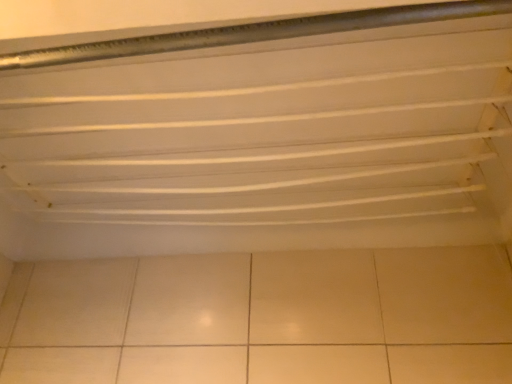
Image resolution: width=512 pixels, height=384 pixels. What do you see at coordinates (263, 318) in the screenshot? I see `beige ceramic tile at bottom` at bounding box center [263, 318].

At what (x,y) coordinates should I click in order to perform the action: click on beige ceramic tile at bottom. Please return your answer as a coordinate pair (x, y). Looking at the image, I should click on (263, 318).

What is the approximate height of beige ceramic tile at bottom?

The height of beige ceramic tile at bottom is 14.08 inches.

The height and width of the screenshot is (384, 512). Describe the element at coordinates (259, 136) in the screenshot. I see `white matte shelf at upper center` at that location.

Locate an element on the screen. The height and width of the screenshot is (384, 512). white matte shelf at upper center is located at coordinates (259, 136).

Measure the distance between white matte shelf at upper center and camera.

24.25 inches.

Locate an element on the screen. This screenshot has width=512, height=384. beige ceramic tile at bottom is located at coordinates (263, 318).

Which is more to the left, white matte shelf at upper center or beige ceramic tile at bottom?

Positioned to the left is white matte shelf at upper center.

Which is behind, white matte shelf at upper center or beige ceramic tile at bottom?

Positioned behind is beige ceramic tile at bottom.

Is point (396, 130) farther from viewer compared to point (416, 331)?

No, it is not.

From the image's perspective, is white matte shelf at upper center beneath beige ceramic tile at bottom?

No, from the image's perspective, white matte shelf at upper center is not below beige ceramic tile at bottom.

From a real-world perspective, which object rests below the other?

beige ceramic tile at bottom, from a real-world perspective.

Looking at this image, can you confirm if white matte shelf at upper center is thinner than beige ceramic tile at bottom?

Incorrect, the width of white matte shelf at upper center is not less than that of beige ceramic tile at bottom.

Can you confirm if white matte shelf at upper center is shorter than beige ceramic tile at bottom?

Indeed, white matte shelf at upper center has a lesser height compared to beige ceramic tile at bottom.

Looking at the image, does white matte shelf at upper center seem bigger or smaller compared to beige ceramic tile at bottom?

Considering their sizes, white matte shelf at upper center takes up more space than beige ceramic tile at bottom.

Would you say white matte shelf at upper center is outside beige ceramic tile at bottom?

Yes.

Are white matte shelf at upper center and beige ceramic tile at bottom located far from each other?

Actually, white matte shelf at upper center and beige ceramic tile at bottom are a little close together.

Is white matte shelf at upper center facing away from beige ceramic tile at bottom?

No, beige ceramic tile at bottom is not at the back of white matte shelf at upper center.

Can you tell me how much white matte shelf at upper center and beige ceramic tile at bottom differ in facing direction?

The angular difference between white matte shelf at upper center and beige ceramic tile at bottom is 180 degrees.

Measure the distance from white matte shelf at upper center to beige ceramic tile at bottom.

11.72 inches.

I want to click on ceramic tile behind the white matte shelf at upper center, so click(x=263, y=318).

Is beige ceramic tile at bottom to the left of white matte shelf at upper center from the viewer's perspective?

Incorrect, beige ceramic tile at bottom is not on the left side of white matte shelf at upper center.

Based on the photo, is beige ceramic tile at bottom in front of white matte shelf at upper center?

No, beige ceramic tile at bottom is further to the viewer.

Is point (129, 292) positioned after point (177, 164)?

Yes, point (129, 292) is farther from viewer.

From the image's perspective, which is above, beige ceramic tile at bottom or white matte shelf at upper center?

white matte shelf at upper center appears higher in the image.

From a real-world perspective, between beige ceramic tile at bottom and white matte shelf at upper center, who is vertically lower?

beige ceramic tile at bottom.

Can you confirm if beige ceramic tile at bottom is wider than white matte shelf at upper center?

No, beige ceramic tile at bottom is not wider than white matte shelf at upper center.

Considering the relative sizes of beige ceramic tile at bottom and white matte shelf at upper center in the image provided, is beige ceramic tile at bottom taller than white matte shelf at upper center?

Indeed, beige ceramic tile at bottom has a greater height compared to white matte shelf at upper center.

Who is smaller, beige ceramic tile at bottom or white matte shelf at upper center?

beige ceramic tile at bottom is smaller.

Is beige ceramic tile at bottom situated inside white matte shelf at upper center or outside?

beige ceramic tile at bottom is outside white matte shelf at upper center.

Are beige ceramic tile at bottom and white matte shelf at upper center located far from each other?

No, beige ceramic tile at bottom is not far away from white matte shelf at upper center.

Is beige ceramic tile at bottom facing towards white matte shelf at upper center?

No, beige ceramic tile at bottom does not turn towards white matte shelf at upper center.

What's the angular difference between beige ceramic tile at bottom and white matte shelf at upper center's facing directions?

The angle between the facing direction of beige ceramic tile at bottom and the facing direction of white matte shelf at upper center is 180 degrees.

This screenshot has width=512, height=384. What are the coordinates of `ceramic tile behind the white matte shelf at upper center` in the screenshot? It's located at (263, 318).

At what (x,y) coordinates should I click in order to perform the action: click on shelf located on the left of beige ceramic tile at bottom. Please return your answer as a coordinate pair (x, y). The height and width of the screenshot is (384, 512). Looking at the image, I should click on (259, 136).

You are a GUI agent. You are given a task and a screenshot of the screen. Output one action in this format:
    pyautogui.click(x=<x>, y=<y>)
    Task: Click on the ceramic tile directly beneath the white matte shelf at upper center (from a real-world perspective)
    The height and width of the screenshot is (384, 512).
    Given the screenshot: What is the action you would take?
    pyautogui.click(x=263, y=318)